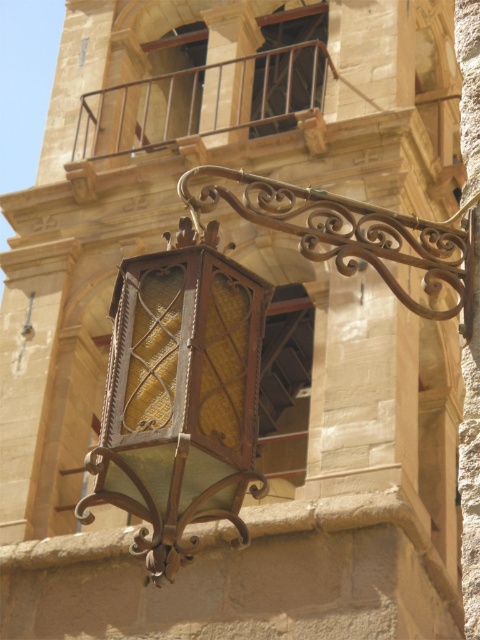
Which of these two, matte glass lantern at center or rustic metal balcony at upper center, stands taller?

rustic metal balcony at upper center

Between point (121, 488) and point (327, 56), which one is positioned in front?

Positioned in front is point (121, 488).

The width and height of the screenshot is (480, 640). What are the coordinates of `matte glass lantern at center` in the screenshot? It's located at (180, 396).